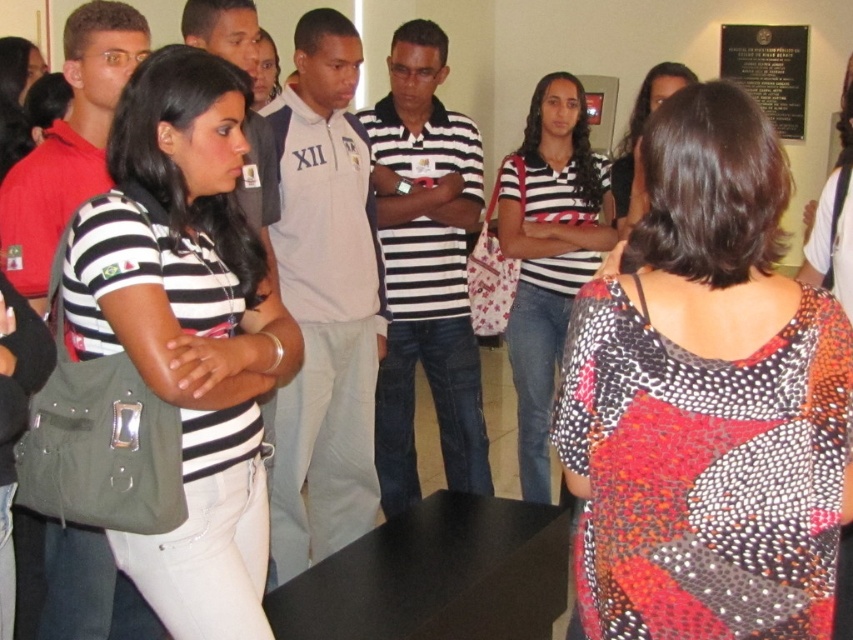
Question: Which object appears closest to the camera in this image?

Choices:
 (A) striped cotton shirt at center
 (B) matte black shirt at center
 (C) black polished stone plaque at upper right

Answer: (B)

Question: Is matte black shirt at center to the left of striped cotton shirt at center from the viewer's perspective?

Choices:
 (A) no
 (B) yes

Answer: (B)

Question: Estimate the real-world distances between objects in this image. Which object is closer to the black polished stone plaque at upper right?

Choices:
 (A) matte black shirt at center
 (B) striped cotton shirt at center

Answer: (B)

Question: Based on their relative distances, which object is nearer to the matte black shirt at center?

Choices:
 (A) striped cotton shirt at center
 (B) black polished stone plaque at upper right

Answer: (A)

Question: Can you confirm if striped cotton shirt at center is positioned to the left of black polished stone plaque at upper right?

Choices:
 (A) yes
 (B) no

Answer: (A)

Question: Does matte black shirt at center lie behind striped cotton shirt at center?

Choices:
 (A) yes
 (B) no

Answer: (B)